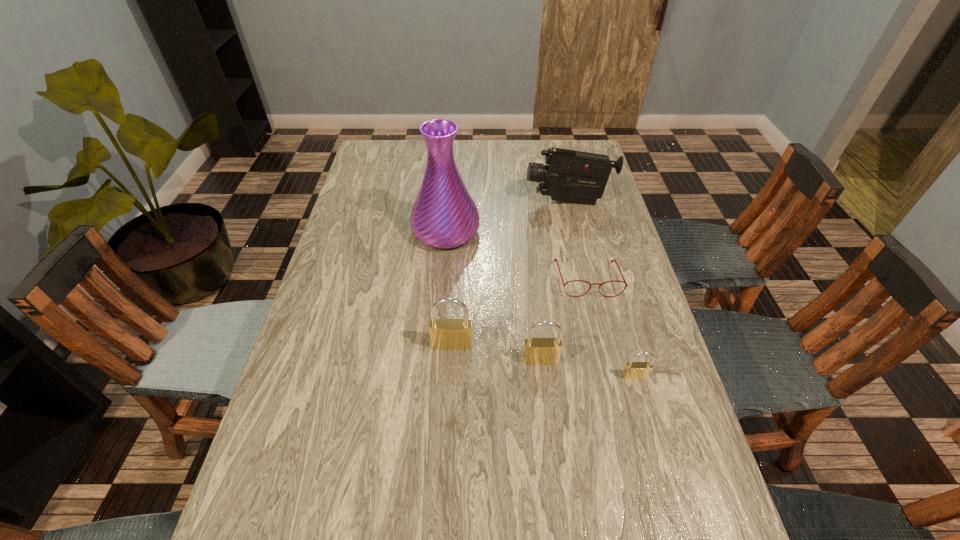
Select which padlock is the second closest to the vase. Please provide its 2D coordinates. Your answer should be formatted as a tuple, i.e. [(x, y)], where the tuple contains the x and y coordinates of a point satisfying the conditions above.

[(537, 351)]

Where is `the closest padlock to the farthest padlock`? This screenshot has width=960, height=540. the closest padlock to the farthest padlock is located at coordinates (537, 351).

Find the location of a particular element. The width and height of the screenshot is (960, 540). free spot that satisfies the following two spatial constraints: 1. on the front-facing side of the farthest object; 2. on the front-facing side of the leftmost padlock is located at coordinates (601, 345).

This screenshot has height=540, width=960. What are the coordinates of `free space that satisfies the following two spatial constraints: 1. on the front-facing side of the camcorder; 2. on the front-facing side of the second tallest padlock` in the screenshot? It's located at (605, 360).